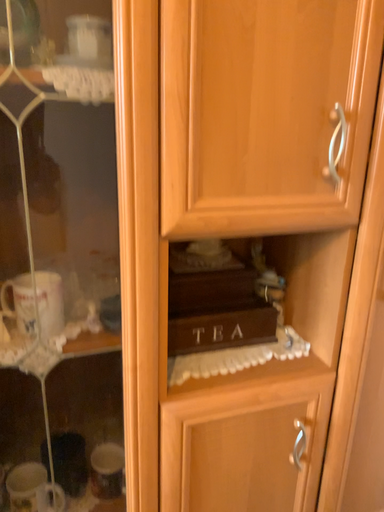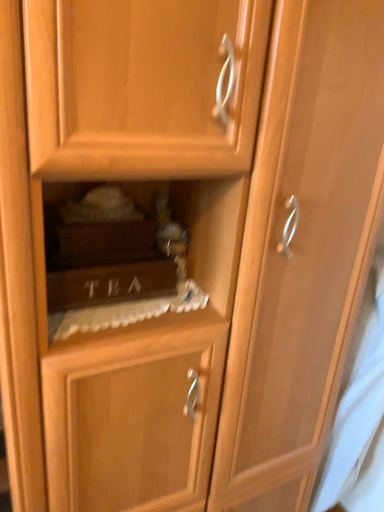
Question: Which way did the camera rotate in the video?

Choices:
 (A) rotated right
 (B) rotated left

Answer: (A)